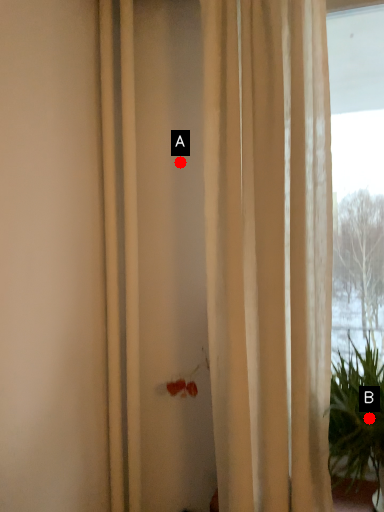
Question: Two points are circled on the image, labeled by A and B beside each circle. Which point is closer to the camera?

Choices:
 (A) A is closer
 (B) B is closer

Answer: (B)